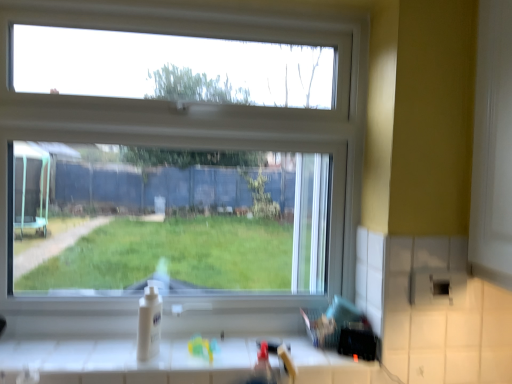
You are a GUI agent. You are given a task and a screenshot of the screen. Output one action in this format:
    pyautogui.click(x=<x>, y=<y>)
    Task: Click on the vacant space situated above white glossy counter at lower center (from a real-world perspective)
    
    Given the screenshot: What is the action you would take?
    pyautogui.click(x=185, y=346)